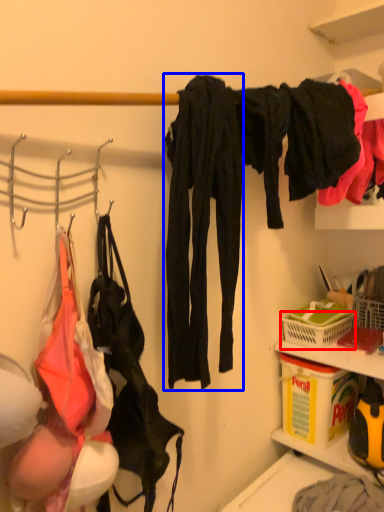
Question: Which point is further to the camera, basket (highlighted by a red box) or clothing (highlighted by a blue box)?

Choices:
 (A) basket
 (B) clothing

Answer: (A)